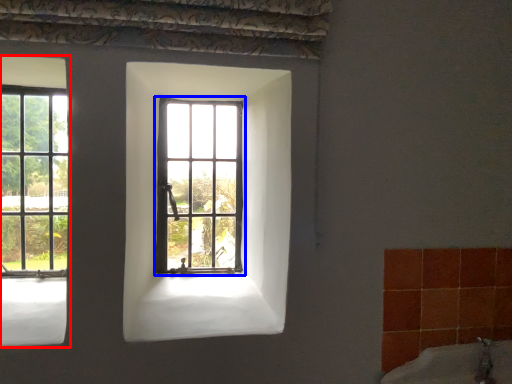
Question: Which point is closer to the camera, window (highlighted by a red box) or window (highlighted by a blue box)?

Choices:
 (A) window
 (B) window

Answer: (A)